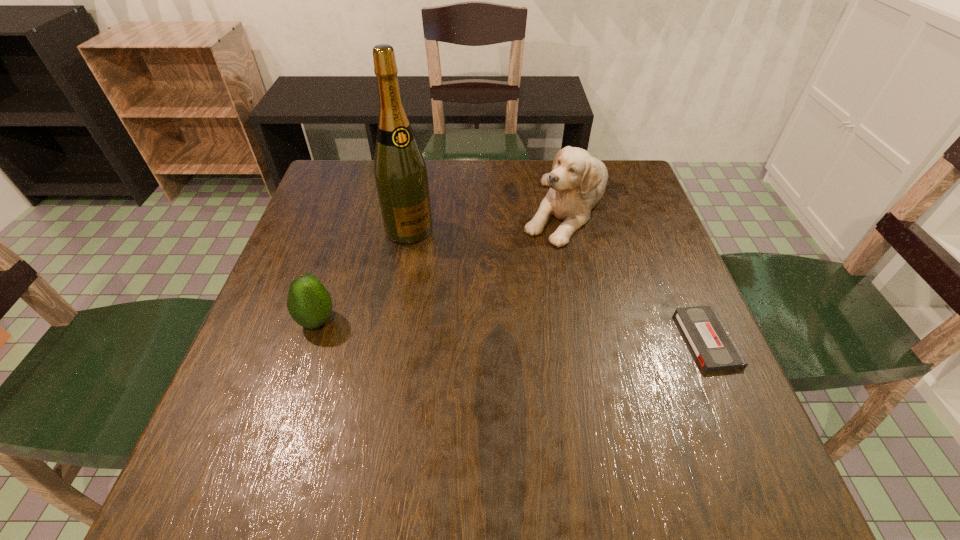
Identify the location of the second shortest object. (309, 303).

The height and width of the screenshot is (540, 960). Identify the location of avocado. (309, 303).

Find the location of `the rightmost object`. the rightmost object is located at coordinates (714, 347).

Identify the location of the shortest object. (714, 347).

Where is `the tallest object`? the tallest object is located at coordinates (401, 178).

Image resolution: width=960 pixels, height=540 pixels. I want to click on wine bottle, so click(401, 178).

Where is `puppy`? puppy is located at coordinates (577, 182).

At what (x,y) coordinates should I click in order to perform the action: click on the third shortest object. Please return your answer as a coordinate pair (x, y). This screenshot has height=540, width=960. Looking at the image, I should click on 577,182.

Identify the location of free spot located on the back of the avocado. (330, 278).

The width and height of the screenshot is (960, 540). Identify the location of vacant position located 0.200m on the left of the videotape. (584, 340).